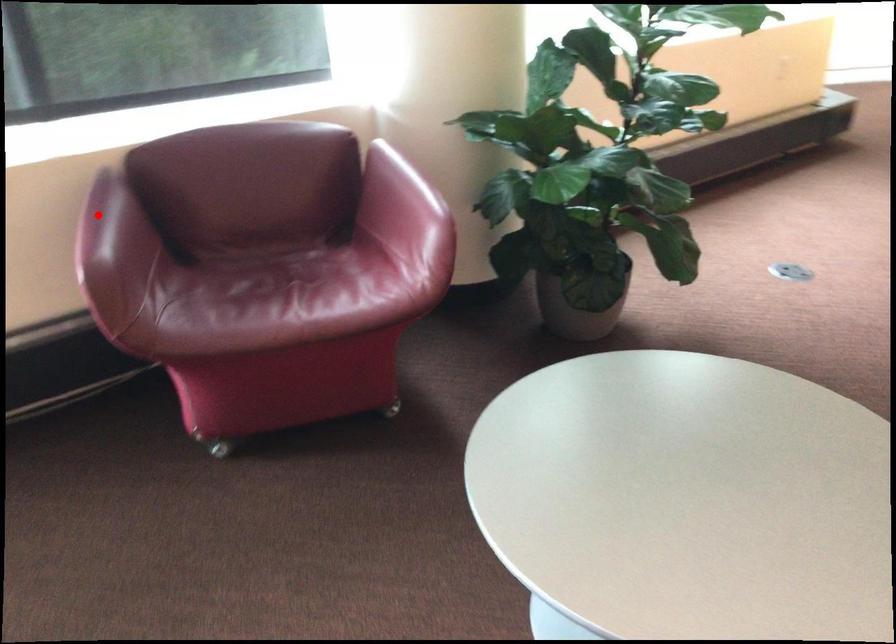
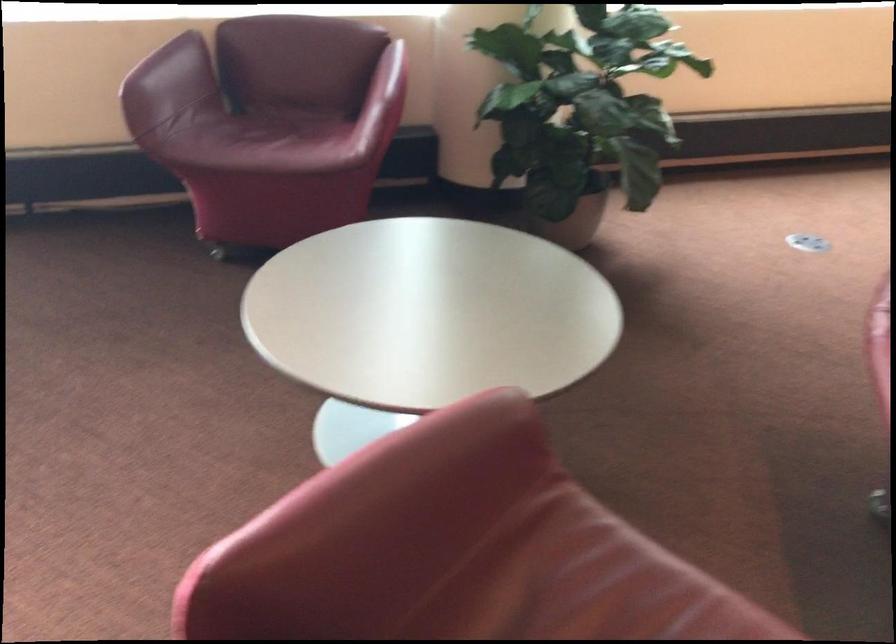
Question: A red point is marked in image1. In image2, is the corresponding 3D point closer to the camera or farther? Reply with the corresponding letter.

Choices:
 (A) The corresponding 3D point is closer.
 (B) The corresponding 3D point is farther.

Answer: (B)